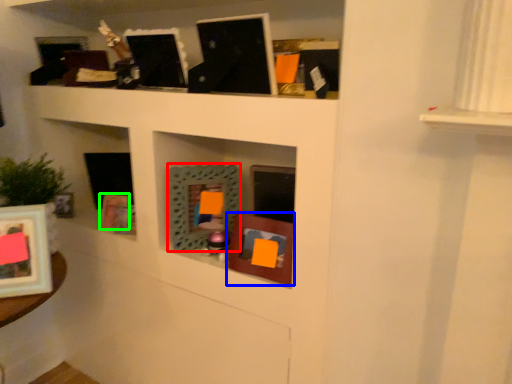
Question: Which is farther away from picture frame (highlighted by a red box)? picture frame (highlighted by a blue box) or picture frame (highlighted by a green box)?

Choices:
 (A) picture frame
 (B) picture frame

Answer: (B)